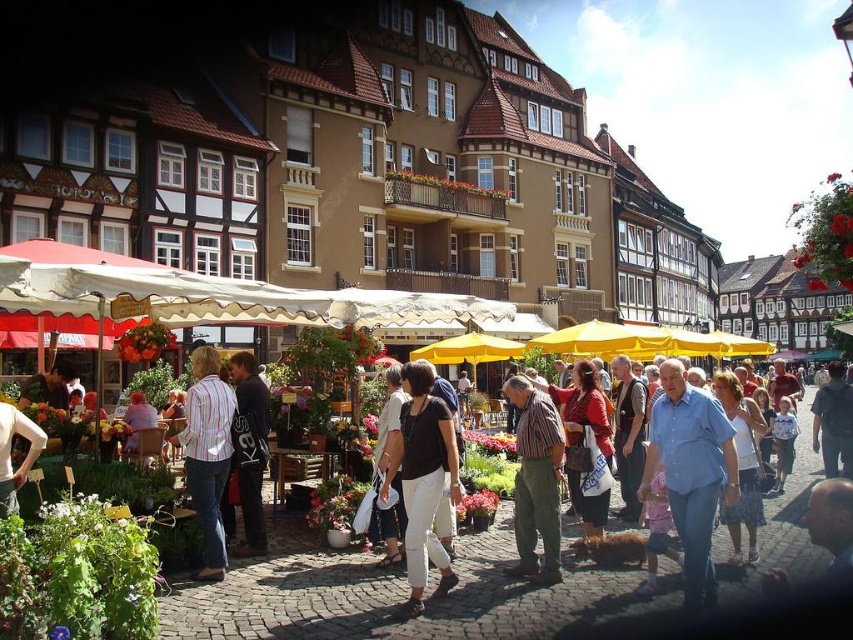
You are a customer at the market and want to find the striped fabric shirt at center. According to the map coordinates, where should you look to find it?

The striped fabric shirt at center is located at coordinates point (537, 481).